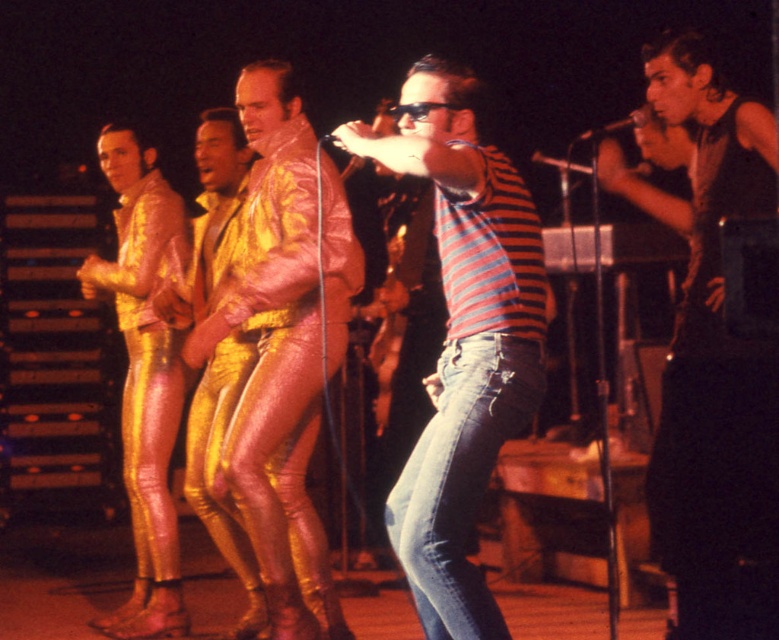
Who is taller, blue denim jeans at center or metallic gold pants at center?

Standing taller between the two is metallic gold pants at center.

Does blue denim jeans at center have a lesser height compared to metallic gold pants at center?

Yes.

Which is in front, point (478, 422) or point (203, 416)?

Point (478, 422) is in front.

Identify the location of blue denim jeans at center. (460, 477).

Is point (696, 572) positioned after point (254, 435)?

No, it is not.

Can you confirm if black leather vest at right is bigger than metallic gold suit at center?

Indeed, black leather vest at right has a larger size compared to metallic gold suit at center.

This screenshot has width=779, height=640. In order to click on black leather vest at right in this screenshot , I will do `click(711, 358)`.

Can you confirm if striped cotton shirt at center is positioned below metallic gold pants at center?

No.

Where is `striped cotton shirt at center`? The height and width of the screenshot is (640, 779). striped cotton shirt at center is located at coordinates (462, 339).

At what (x,y) coordinates should I click in order to perform the action: click on striped cotton shirt at center. Please return your answer as a coordinate pair (x, y). This screenshot has width=779, height=640. Looking at the image, I should click on (462, 339).